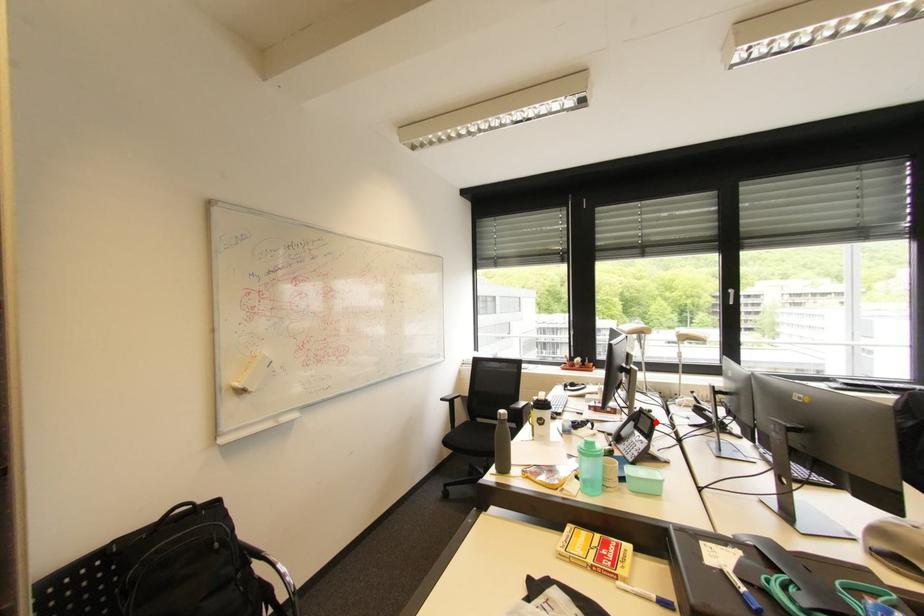
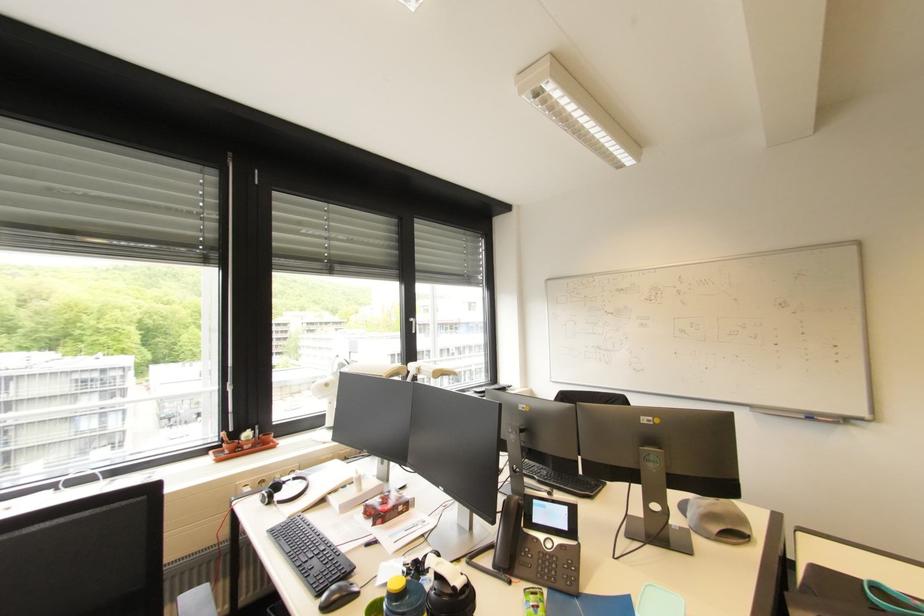
Question: I am providing you with two images of the same scene from different viewpoints. A red point is marked on the first image. Is the red point's position out of view in image 2?

Choices:
 (A) Yes
 (B) No

Answer: (B)